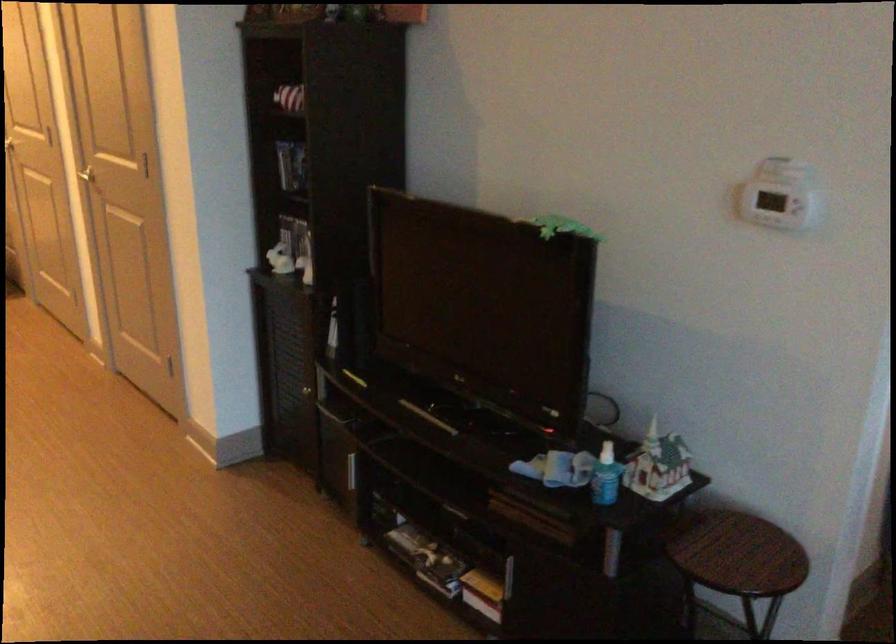
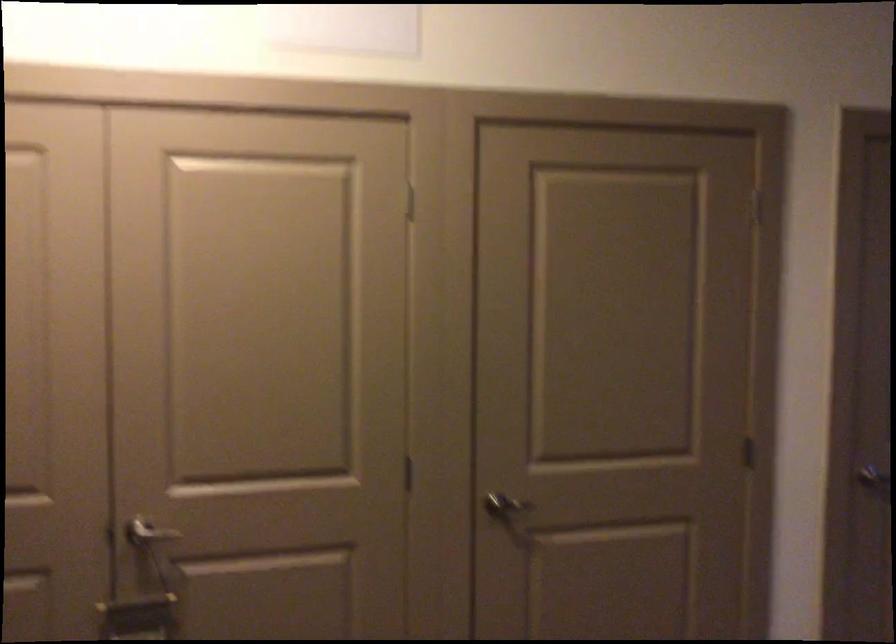
Where in the second image is the point corresponding to pixel 113 183 from the first image?

(853, 476)